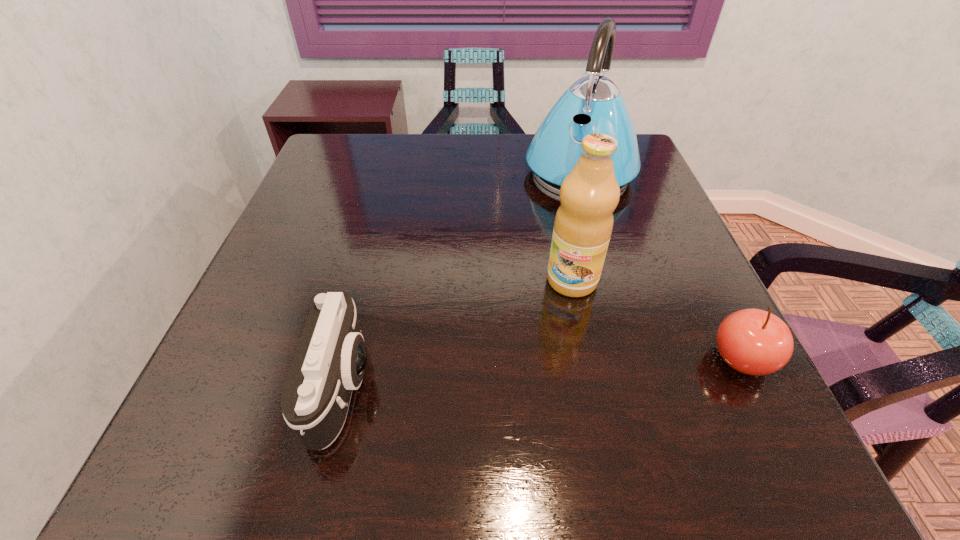
At what (x,y) coordinates should I click in order to perform the action: click on free spot located on the label of the third shortest object. Please return your answer as a coordinate pair (x, y). This screenshot has width=960, height=540. Looking at the image, I should click on (535, 358).

Locate an element on the screen. The height and width of the screenshot is (540, 960). free region located at the spout of the farthest object is located at coordinates (537, 276).

Find the location of a particular element. The width and height of the screenshot is (960, 540). free location located 0.250m at the spout of the farthest object is located at coordinates (540, 267).

The height and width of the screenshot is (540, 960). What are the coordinates of `vacant space situated 0.330m at the spout of the farthest object` in the screenshot? It's located at (529, 293).

The height and width of the screenshot is (540, 960). I want to click on object that is at the far edge, so click(593, 104).

Locate an element on the screen. camera at the near edge is located at coordinates tap(330, 359).

This screenshot has height=540, width=960. I want to click on apple that is at the near edge, so click(755, 342).

The width and height of the screenshot is (960, 540). Find the location of `apple that is at the right edge`. apple that is at the right edge is located at coordinates [x=755, y=342].

You are a GUI agent. You are given a task and a screenshot of the screen. Output one action in this format:
    pyautogui.click(x=<x>, y=<y>)
    Task: Click on the kettle at the right edge
    This screenshot has height=540, width=960.
    Given the screenshot: What is the action you would take?
    pyautogui.click(x=593, y=104)

This screenshot has width=960, height=540. In order to click on object that is at the far right corner in this screenshot , I will do `click(593, 104)`.